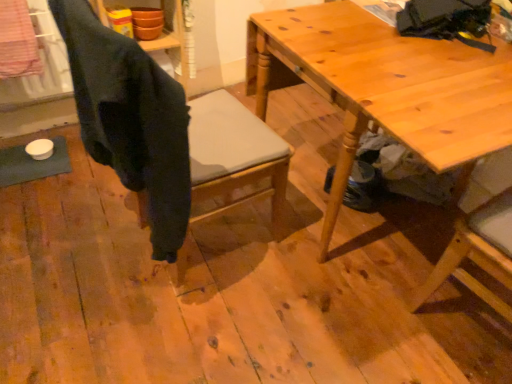
Locate an element on the screen. vacant area that is in front of dark gray fabric chair at center is located at coordinates (178, 323).